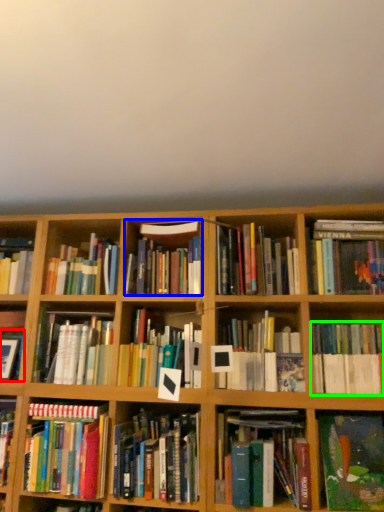
Question: Estimate the real-world distances between objects in this image. Which object is closer to book (highlighted by a red box), book (highlighted by a blue box) or book (highlighted by a green box)?

Choices:
 (A) book
 (B) book

Answer: (A)